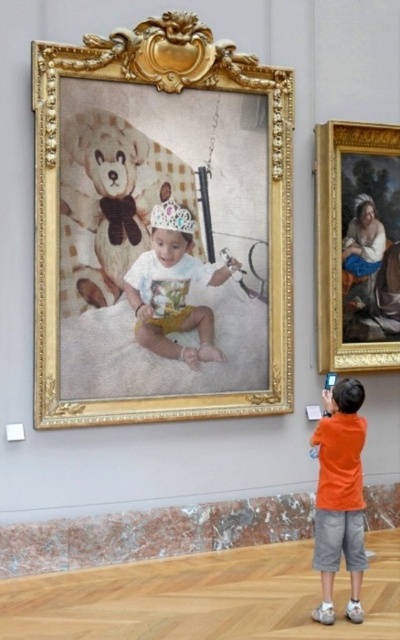
Who is lower down, goldmetallicpicture frame at right or matte white crown at center?

matte white crown at center is lower down.

Between goldmetallicpicture frame at right and matte white crown at center, which one is positioned higher?

goldmetallicpicture frame at right

Between point (391, 282) and point (142, 340), which one is positioned in front?

Point (142, 340)

Locate an element on the screen. This screenshot has height=640, width=400. goldmetallicpicture frame at right is located at coordinates (356, 244).

Does point (279, 179) come farther from viewer compared to point (332, 586)?

Yes, it is behind point (332, 586).

Can you confirm if gold ornate frame at upper center is positioned above orange cotton shirt at lower right?

Yes, gold ornate frame at upper center is above orange cotton shirt at lower right.

Who is more distant from viewer, (144, 193) or (324, 534)?

Point (144, 193)

Locate an element on the screen. gold ornate frame at upper center is located at coordinates (161, 228).

Does point (86, 125) lie in front of point (152, 308)?

Yes, it is.

This screenshot has height=640, width=400. What do you see at coordinates (161, 228) in the screenshot?
I see `gold ornate frame at upper center` at bounding box center [161, 228].

Image resolution: width=400 pixels, height=640 pixels. I want to click on gold ornate frame at upper center, so click(161, 228).